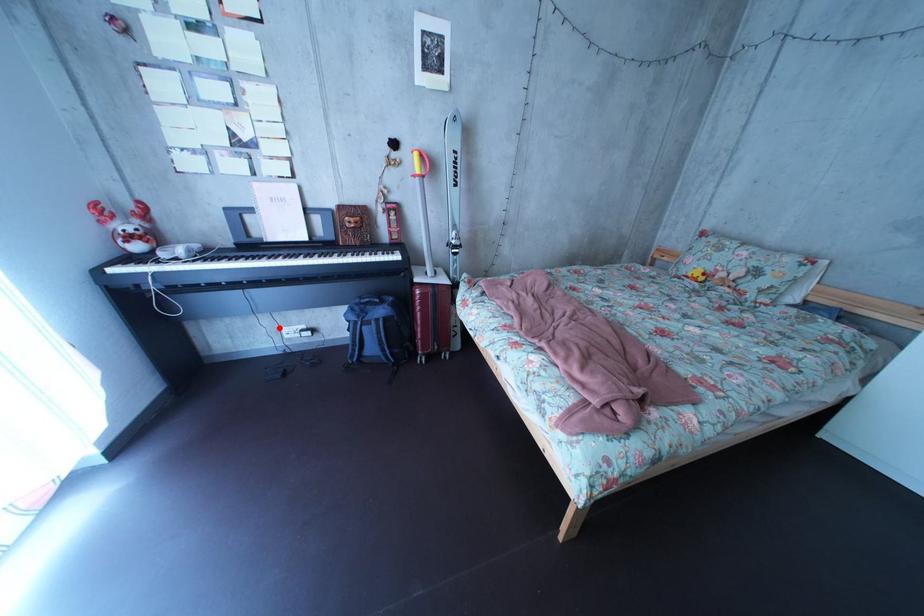
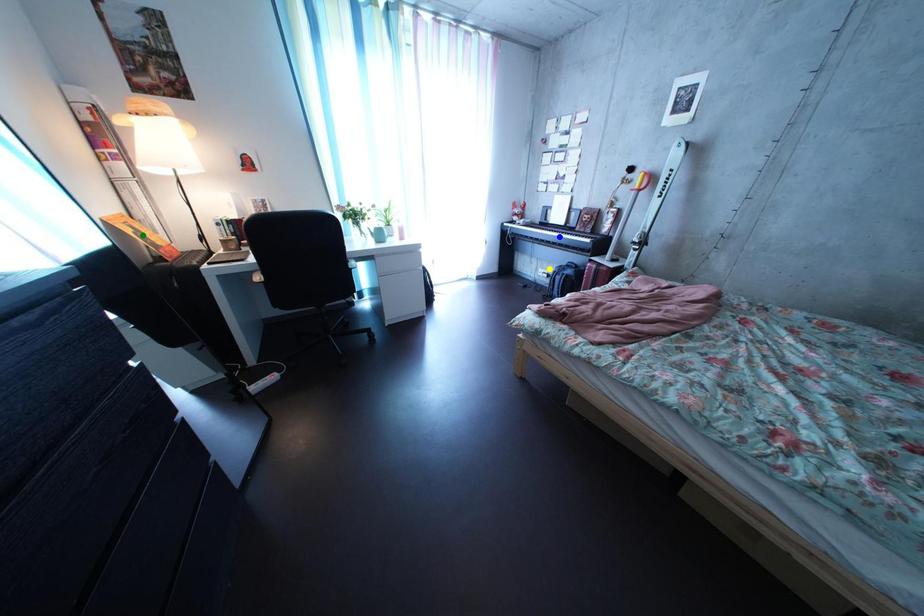
Question: I am providing you with two images of the same scene from different viewpoints. A red point is marked on the first image. You are given multiple points on the second image. Which mark in image 2 goes with the point in image 1?

Choices:
 (A) yellow point
 (B) blue point
 (C) green point

Answer: (A)